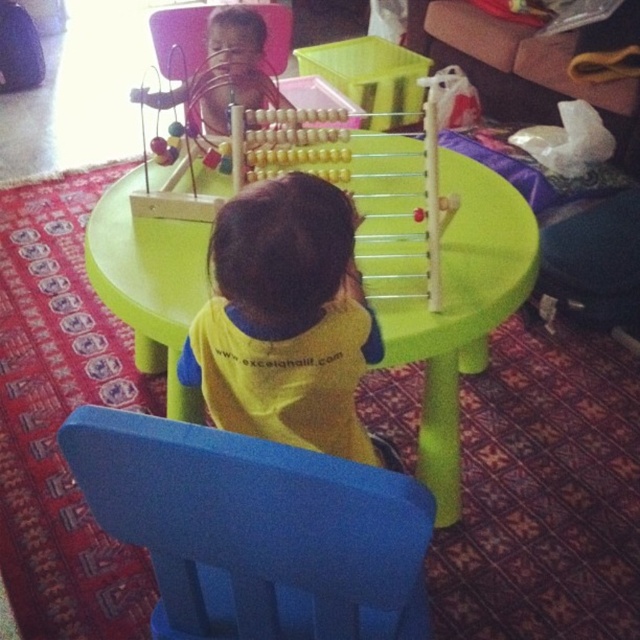
You are a parent trying to clean up the play area. You need to store the blue plastic chair at lower center and the wooden beads at center. Which item takes up more space when stored?

The blue plastic chair at lower center is larger in size than the wooden beads at center, so it will take up more space when stored.

You are standing in the room and see two points marked in the image. Which point, point (330,593) or point (346,115), is closer to you?

Point (330,593) is closer to the viewer than point (346,115).

In the scene shown: You are a parent trying to clean up the play area. You need to move the blue plastic chair at lower center and the wooden beads at center to a storage closet. Which object should you move first to ensure you can reach the other without obstruction?

You should move the blue plastic chair at lower center first because it is to the left of the wooden beads at center. By moving the chair first, you can then access the wooden beads at center without the chair blocking your path.